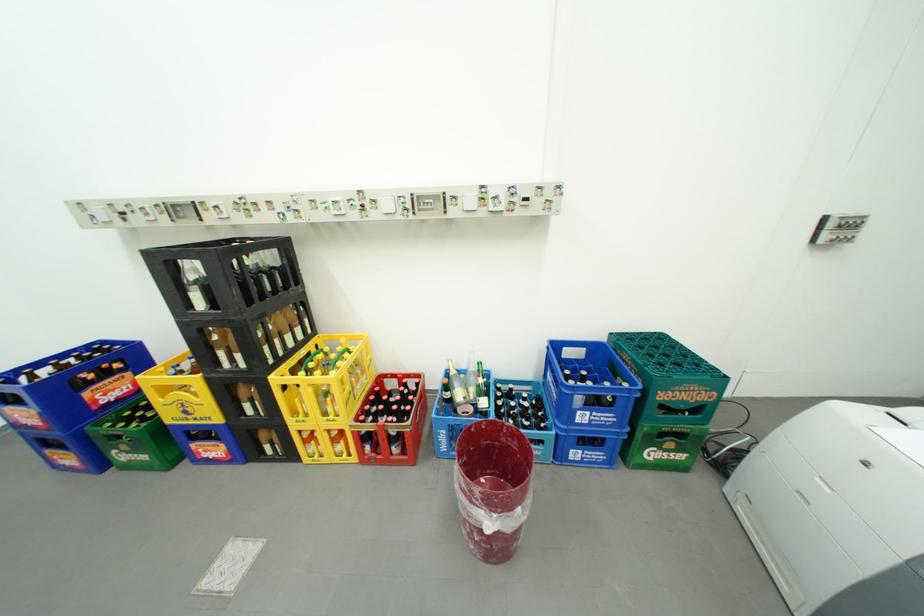
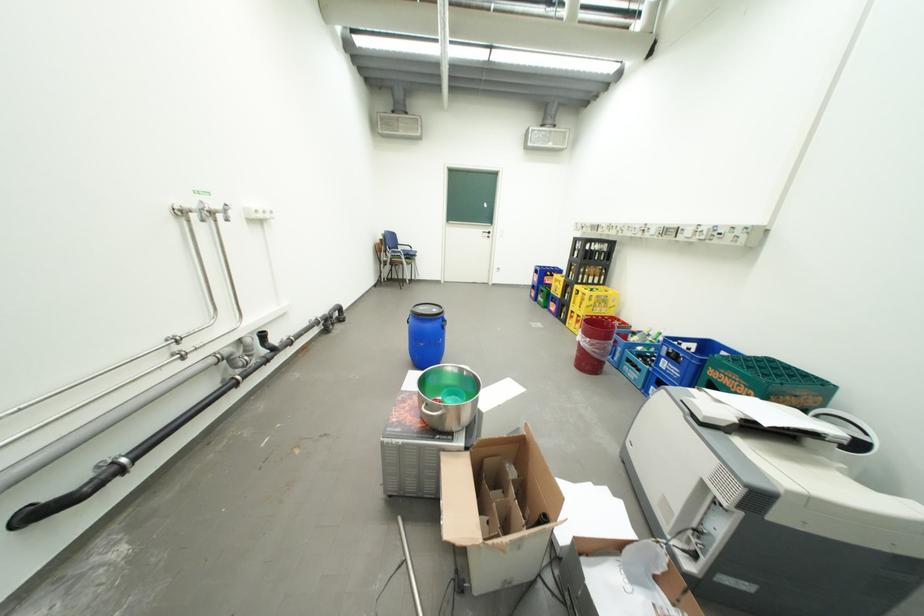
In the second image, find the point that corresponds to [344,422] in the first image.

(590, 312)